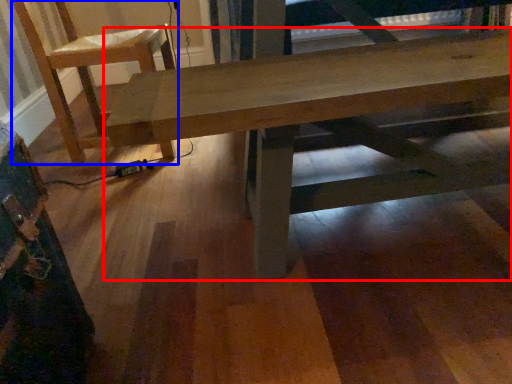
Question: Which of the following is the closest to the observer, table (highlighted by a red box) or chair (highlighted by a blue box)?

Choices:
 (A) table
 (B) chair

Answer: (A)